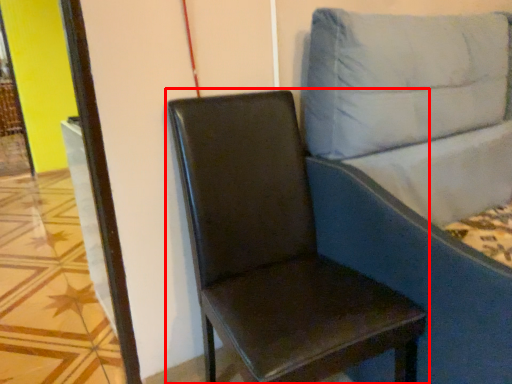
Question: From the image's perspective, considering the relative positions of chair (annotated by the red box) and studio couch in the image provided, where is chair (annotated by the red box) located with respect to the staircase?

Choices:
 (A) below
 (B) above

Answer: (A)